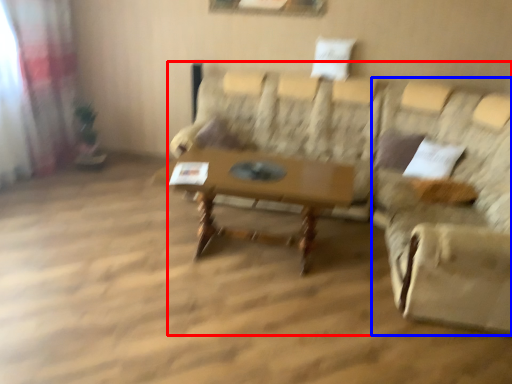
Question: Which point is closer to the camera, studio couch (highlighted by a red box) or swivel chair (highlighted by a blue box)?

Choices:
 (A) studio couch
 (B) swivel chair

Answer: (A)